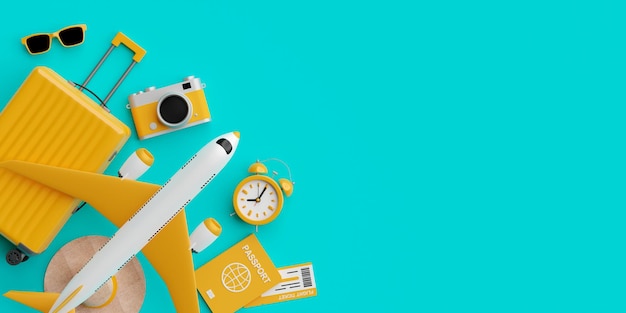
You are a GUI agent. You are given a task and a screenshot of the screen. Output one action in this format:
    pyautogui.click(x=<x>, y=<y>)
    Task: Click on the time on clock is 8 o'clock
    The image size is (626, 313).
    Given the screenshot: What is the action you would take?
    pyautogui.click(x=257, y=198)